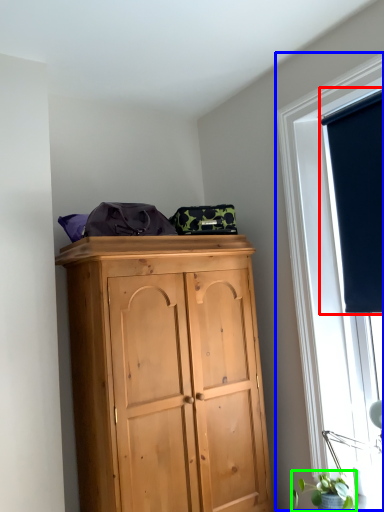
Question: Considering the real-world distances, which object is closest to window screen (highlighted by a red box)? window (highlighted by a blue box) or plant (highlighted by a green box).

Choices:
 (A) window
 (B) plant

Answer: (A)